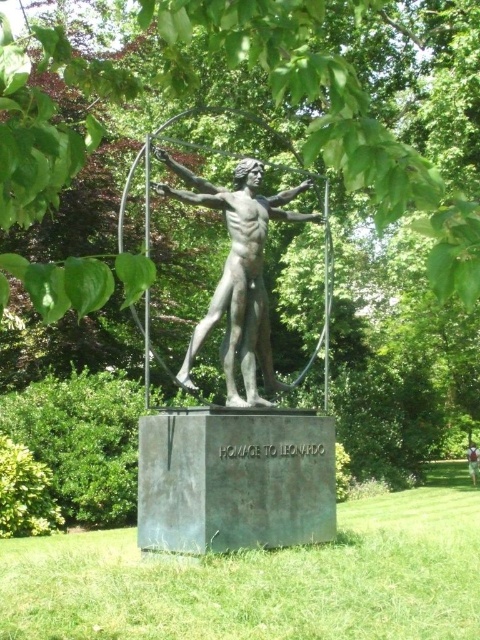
Based on the photo, is bronze statue at center to the left of light brown fabric shirt at center from the viewer's perspective?

Indeed, bronze statue at center is positioned on the left side of light brown fabric shirt at center.

What do you see at coordinates (239, 275) in the screenshot? I see `bronze statue at center` at bounding box center [239, 275].

In order to click on bronze statue at center in this screenshot , I will do `click(239, 275)`.